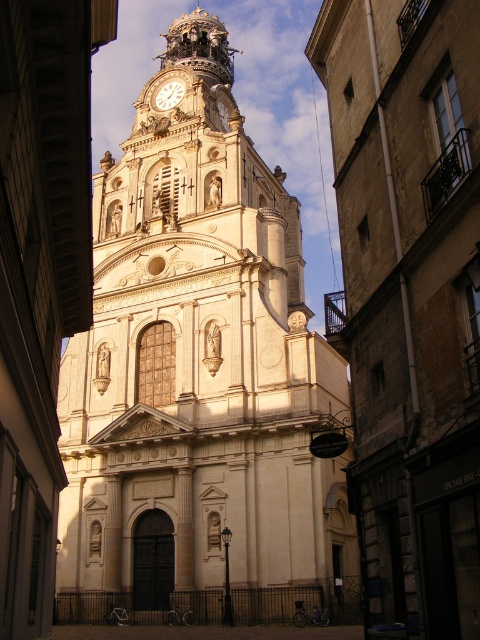
Which is more to the right, white stone tower at center or gold metallic clock at upper center?

gold metallic clock at upper center is more to the right.

Does white stone tower at center lie behind gold metallic clock at upper center?

No, it is in front of gold metallic clock at upper center.

Is point (98, 506) closer to viewer compared to point (163, 97)?

That is True.

This screenshot has width=480, height=640. I want to click on white stone tower at center, so click(x=199, y=369).

Between white stone tower at center and white stone church at center, which one appears on the right side from the viewer's perspective?

white stone church at center is more to the right.

Which is behind, point (204, 461) or point (447, 598)?

Point (204, 461)

In order to click on white stone tower at center in this screenshot , I will do `click(199, 369)`.

Does white stone church at center appear on the left side of gold metallic clock at upper center?

In fact, white stone church at center is to the right of gold metallic clock at upper center.

Consider the image. Which is more to the left, white stone church at center or gold metallic clock at upper center?

gold metallic clock at upper center

The image size is (480, 640). Describe the element at coordinates (409, 298) in the screenshot. I see `white stone church at center` at that location.

This screenshot has height=640, width=480. I want to click on white stone church at center, so click(x=409, y=298).